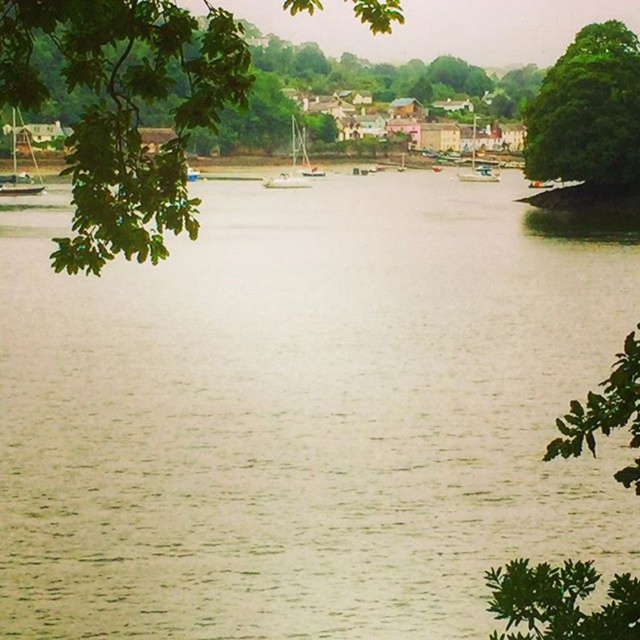
Is point (36, 99) farther from camera compared to point (588, 45)?

No, (36, 99) is closer to viewer.

Which is more to the left, green leafy tree at upper left or green leafy tree at upper right?

green leafy tree at upper left

You are a GUI agent. You are given a task and a screenshot of the screen. Output one action in this format:
    pyautogui.click(x=<x>, y=<y>)
    Task: Click on the green leafy tree at upper left
    
    Given the screenshot: What is the action you would take?
    pyautogui.click(x=124, y=112)

Is green leafy tree at upper left to the left of white wooden sailboat at center from the viewer's perspective?

Correct, you'll find green leafy tree at upper left to the left of white wooden sailboat at center.

Consider the image. Is green leafy tree at upper left in front of white wooden sailboat at center?

Yes, green leafy tree at upper left is in front of white wooden sailboat at center.

Who is more forward, (172, 13) or (481, 173)?

Point (172, 13) is more forward.

This screenshot has width=640, height=640. What are the coordinates of `green leafy tree at upper left` in the screenshot? It's located at (124, 112).

Looking at this image, which of these two, brown water at center or white wooden sailboat at center, stands taller?

brown water at center is taller.

Is point (67, 472) farther from viewer compared to point (472, 166)?

No.

Between point (92, 362) and point (472, 125), which one is positioned in front?

Point (92, 362) is in front.

Where is `brown water at center`? The height and width of the screenshot is (640, 640). brown water at center is located at coordinates (304, 417).